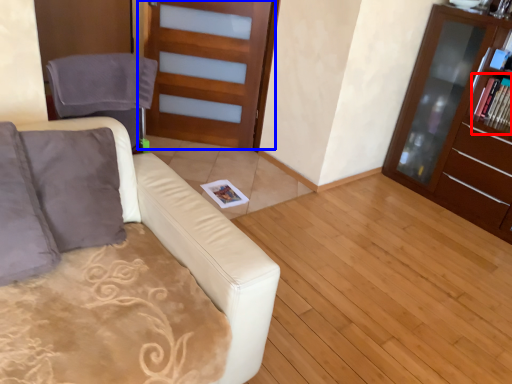
Question: Among these objects, which one is nearest to the camera, magazine (highlighted by a red box) or door (highlighted by a blue box)?

Choices:
 (A) magazine
 (B) door

Answer: (A)